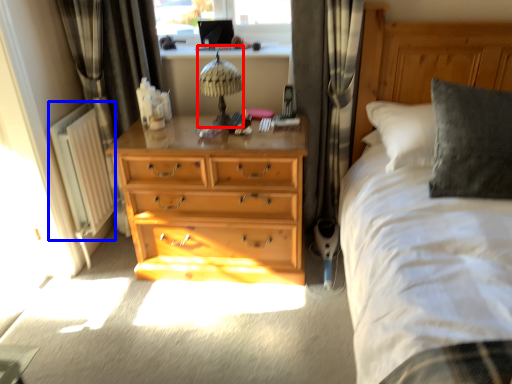
Question: Among these objects, which one is nearest to the camera, table lamp (highlighted by a red box) or radiator (highlighted by a blue box)?

Choices:
 (A) table lamp
 (B) radiator

Answer: (A)